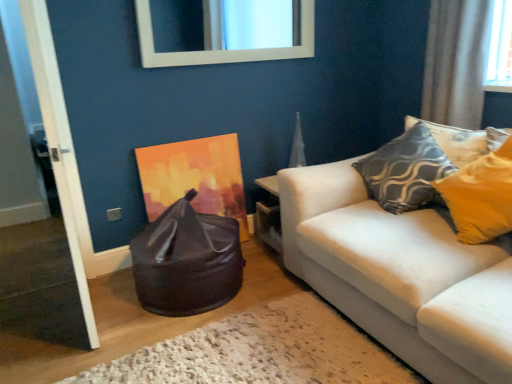
Question: Looking at the image, does textured gray pillow at upper right seem bigger or smaller compared to white wooden door at left?

Choices:
 (A) big
 (B) small

Answer: (B)

Question: Relative to white wooden door at left, is textured gray pillow at upper right in front or behind?

Choices:
 (A) front
 (B) behind

Answer: (B)

Question: Considering the real-world distances, which object is closest to the white glossy mirror at upper center?

Choices:
 (A) glossy black bean bag at lower left
 (B) textured gray pillow at upper right
 (C) white wooden door at left
 (D) white sheer curtain at upper right

Answer: (D)

Question: Which of these objects is positioned farthest from the white glossy mirror at upper center?

Choices:
 (A) white sheer curtain at upper right
 (B) glossy black bean bag at lower left
 (C) white wooden door at left
 (D) textured gray pillow at upper right

Answer: (C)